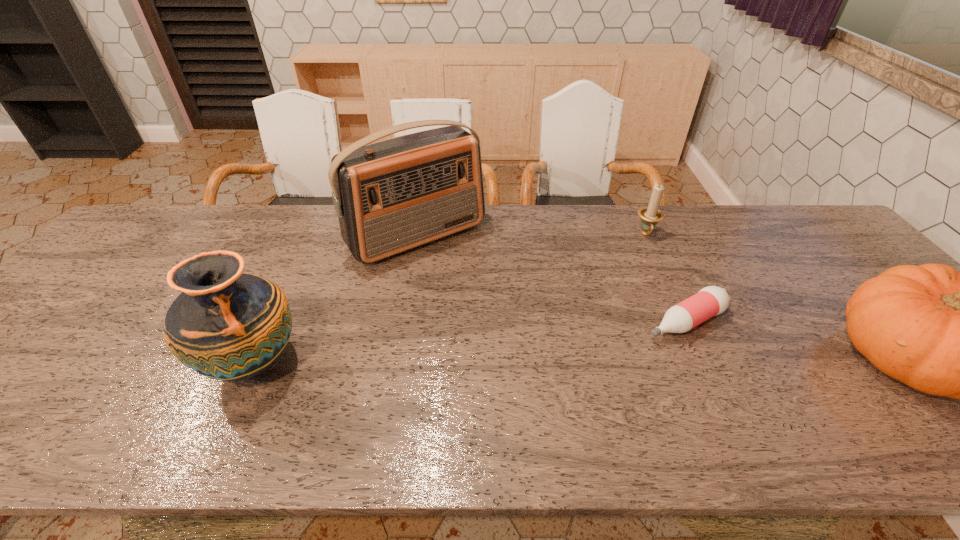
The width and height of the screenshot is (960, 540). In order to click on the leftmost object in this screenshot , I will do `click(230, 326)`.

The image size is (960, 540). I want to click on the second tallest object, so click(x=230, y=326).

The width and height of the screenshot is (960, 540). Identify the location of radio receiver. (391, 196).

This screenshot has width=960, height=540. Identify the location of the fourth object from right to left. (391, 196).

Where is `the shortest object`? Image resolution: width=960 pixels, height=540 pixels. the shortest object is located at coordinates (710, 301).

The width and height of the screenshot is (960, 540). Identify the location of candle_holder. (650, 216).

Where is `free space located 0.180m on the back of the pottery`? The image size is (960, 540). free space located 0.180m on the back of the pottery is located at coordinates (294, 276).

At what (x,y) coordinates should I click in order to perform the action: click on vacant space located 0.390m on the front-facing side of the radio receiver. Please return your answer as a coordinate pair (x, y). This screenshot has height=540, width=960. Looking at the image, I should click on (533, 359).

This screenshot has height=540, width=960. I want to click on vacant region located 0.390m on the front-facing side of the radio receiver, so click(x=533, y=359).

This screenshot has width=960, height=540. I want to click on vacant space situated on the front-facing side of the radio receiver, so click(x=506, y=328).